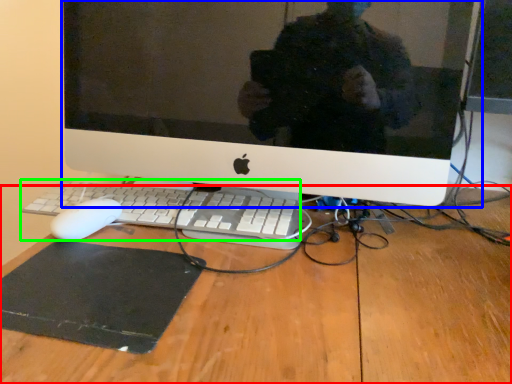
Question: Which is nearer to the desk (highlighted by a red box)? computer monitor (highlighted by a blue box) or computer keyboard (highlighted by a green box).

Choices:
 (A) computer monitor
 (B) computer keyboard

Answer: (B)